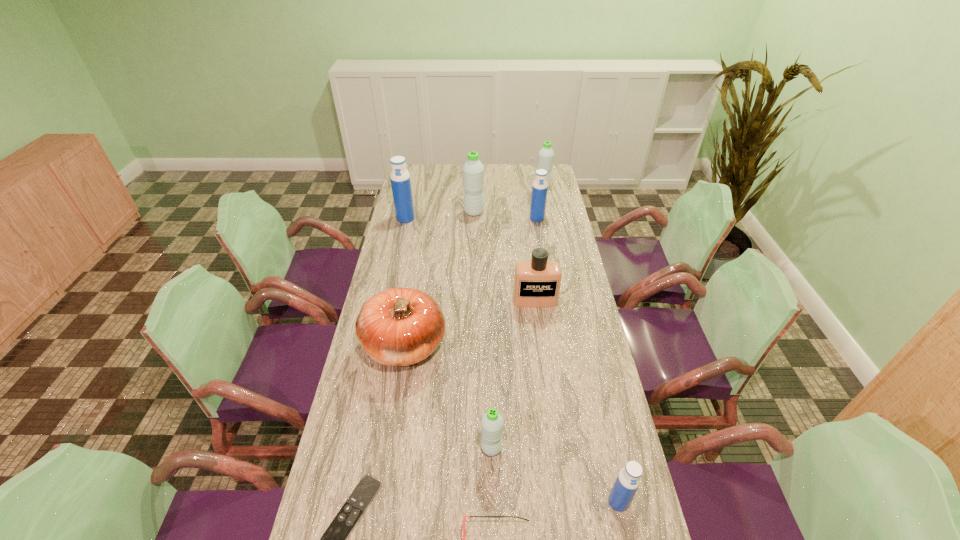
Find the location of a particular element. This screenshot has width=960, height=540. unoccupied position between the pumpkin and the biggest green water bottle is located at coordinates (440, 279).

The width and height of the screenshot is (960, 540). I want to click on empty space between the rightmost green water bottle and the nearest green water bottle, so click(x=517, y=318).

What are the coordinates of `unoccupied position between the second blue water bottle from right to left and the second farthest green water bottle` in the screenshot? It's located at (505, 215).

Where is `free space between the farthest water bottle and the nearest green water bottle`? free space between the farthest water bottle and the nearest green water bottle is located at coordinates (517, 318).

At what (x,y) coordinates should I click in order to perform the action: click on vacant area that lies between the nearest water bottle and the perfume. Please return your answer as a coordinate pair (x, y). The image size is (960, 540). Looking at the image, I should click on (577, 401).

This screenshot has height=540, width=960. What are the coordinates of `unoccupied area between the second blue water bottle from right to left and the nearest green water bottle` in the screenshot? It's located at (515, 333).

Identify which object is located as the ninth nearest to the leftmost blue water bottle. Please provide its 2D coordinates. Your answer should be formatted as a tuple, i.e. [(x, y)], where the tuple contains the x and y coordinates of a point satisfying the conditions above.

[(628, 480)]

Locate an element on the screen. Image resolution: width=960 pixels, height=540 pixels. the fourth closest object to the orange pumpkin is located at coordinates (464, 516).

Select which water bottle is the third closest to the leftmost water bottle. Please provide its 2D coordinates. Your answer should be formatted as a tuple, i.e. [(x, y)], where the tuple contains the x and y coordinates of a point satisfying the conditions above.

[(546, 155)]

Select which water bottle is the second closest to the biggest blue water bottle. Please provide its 2D coordinates. Your answer should be formatted as a tuple, i.e. [(x, y)], where the tuple contains the x and y coordinates of a point satisfying the conditions above.

[(540, 186)]